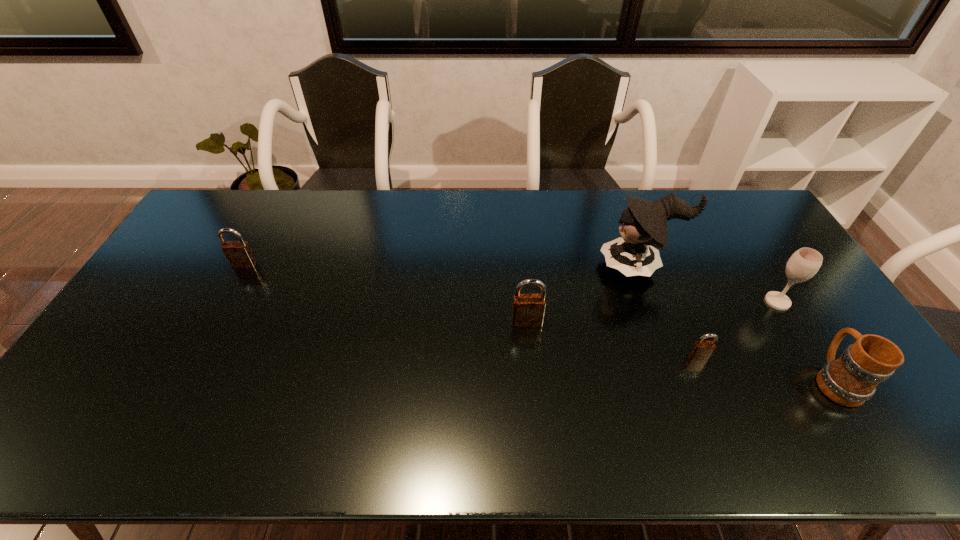
You are a GUI agent. You are given a task and a screenshot of the screen. Output one action in this format:
    pyautogui.click(x=<x>, y=<y>)
    Task: Click on the second tallest padlock
    
    Given the screenshot: What is the action you would take?
    pyautogui.click(x=238, y=253)

Identify the location of the leftmost padlock. (238, 253).

Locate an element on the screen. the second padlock from left to right is located at coordinates (528, 310).

At what (x,y) coordinates should I click in order to perform the action: click on the third nearest object. Please return your answer as a coordinate pair (x, y). Image resolution: width=960 pixels, height=540 pixels. Looking at the image, I should click on (528, 310).

Locate an element on the screen. the shortest object is located at coordinates (701, 350).

You are a GUI agent. You are given a task and a screenshot of the screen. Output one action in this format:
    pyautogui.click(x=<x>, y=<y>)
    Task: Click on the nearest padlock
    Image resolution: width=960 pixels, height=540 pixels.
    Given the screenshot: What is the action you would take?
    pyautogui.click(x=701, y=350)

What are the coordinates of `the third farthest object` in the screenshot? It's located at (804, 263).

Where is `the tallest object`? the tallest object is located at coordinates (644, 223).

At what (x,y) coordinates should I click in order to perform the action: click on mug. Please return your answer as a coordinate pair (x, y). Image resolution: width=960 pixels, height=540 pixels. Looking at the image, I should click on pos(852,379).

Locate an element on the screen. free space located 0.070m on the front-facing side of the second shortest padlock is located at coordinates (234, 284).